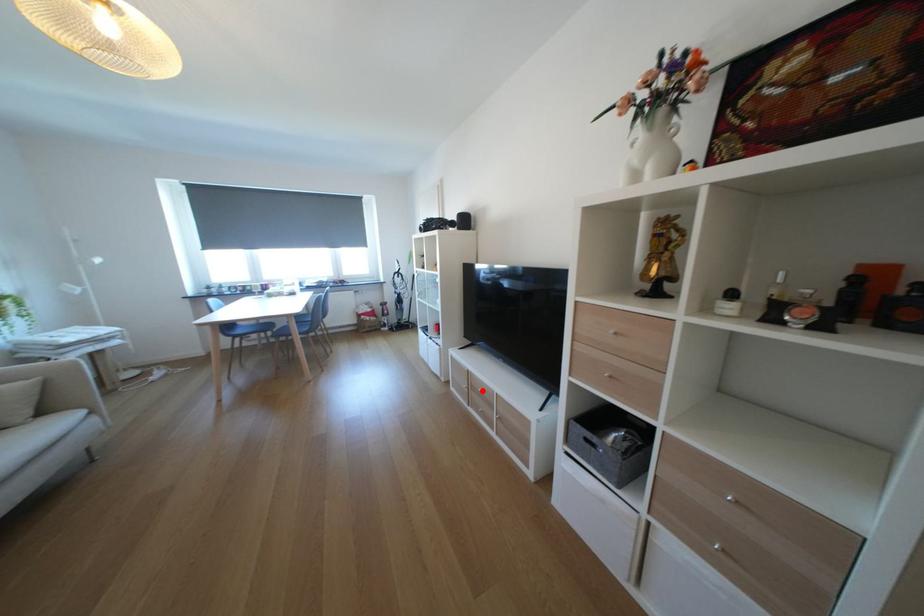
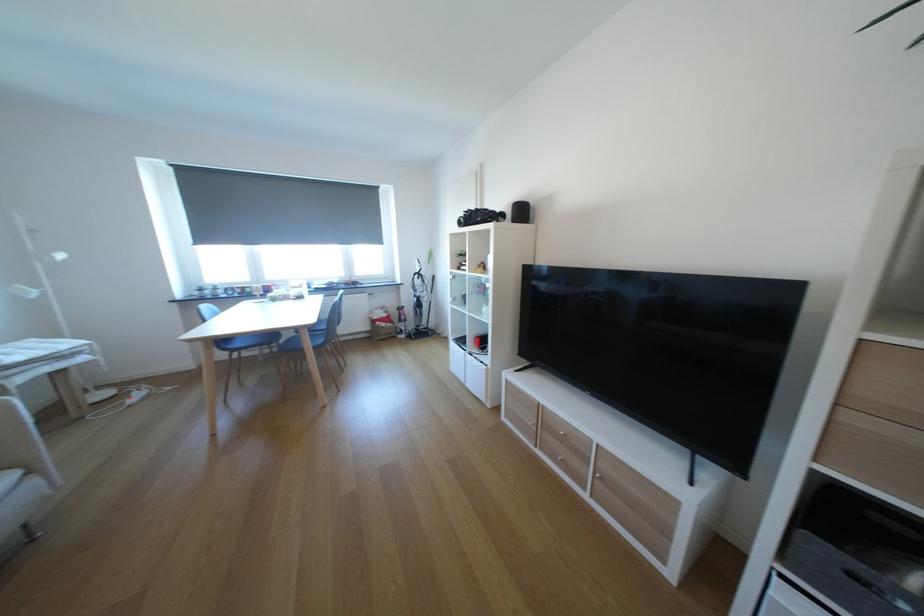
Question: I am providing you with two images of the same scene from different viewpoints. A red point is marked on the first image. Is the red point's position out of view in image 2?

Choices:
 (A) Yes
 (B) No

Answer: (B)